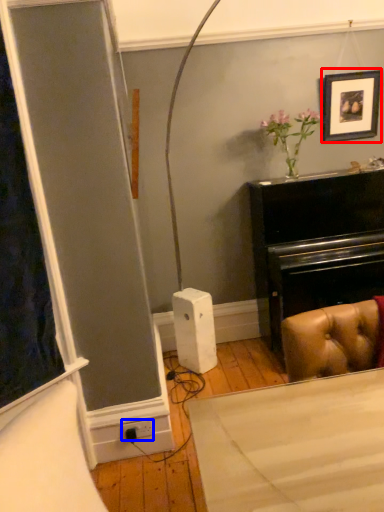
Question: Which object appears closest to the camera in this image, picture frame (highlighted by a red box) or plug (highlighted by a blue box)?

Choices:
 (A) picture frame
 (B) plug

Answer: (B)